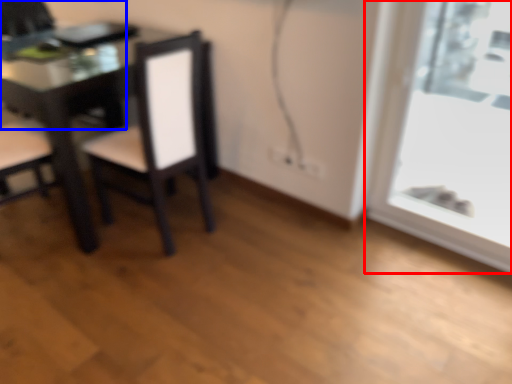
Question: Which point is further to the camera, window (highlighted by a red box) or chair (highlighted by a blue box)?

Choices:
 (A) window
 (B) chair

Answer: (B)